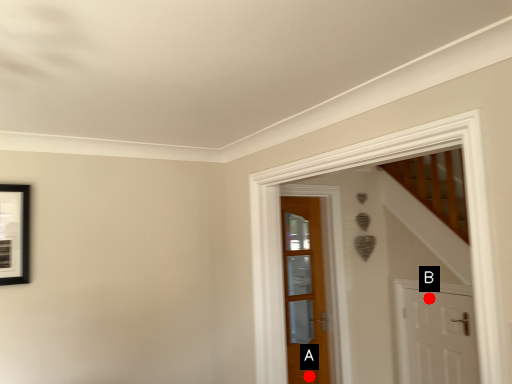
Question: Two points are circled on the image, labeled by A and B beside each circle. Which point is farther to the camera?

Choices:
 (A) A is further
 (B) B is further

Answer: (A)